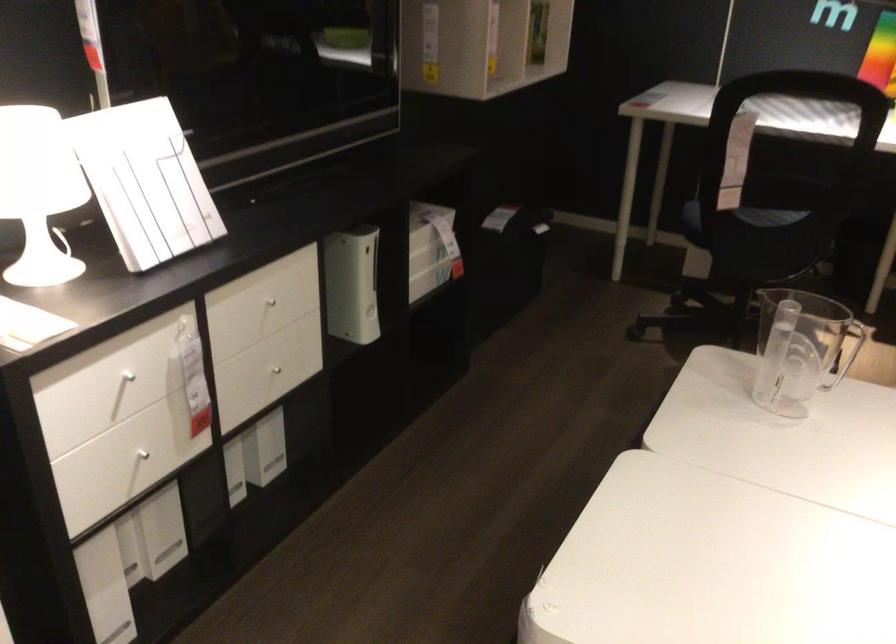
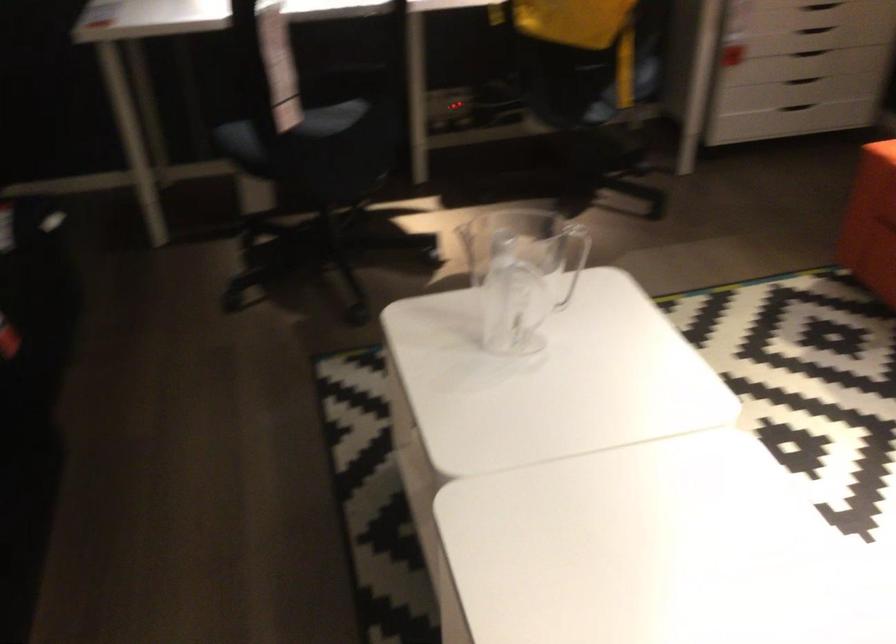
Question: The camera is either moving clockwise (left) or counter-clockwise (right) around the object. The first image is from the beginning of the video and the second image is from the end. Is the camera moving left or right when shooting the video?

Choices:
 (A) Left
 (B) Right

Answer: (A)